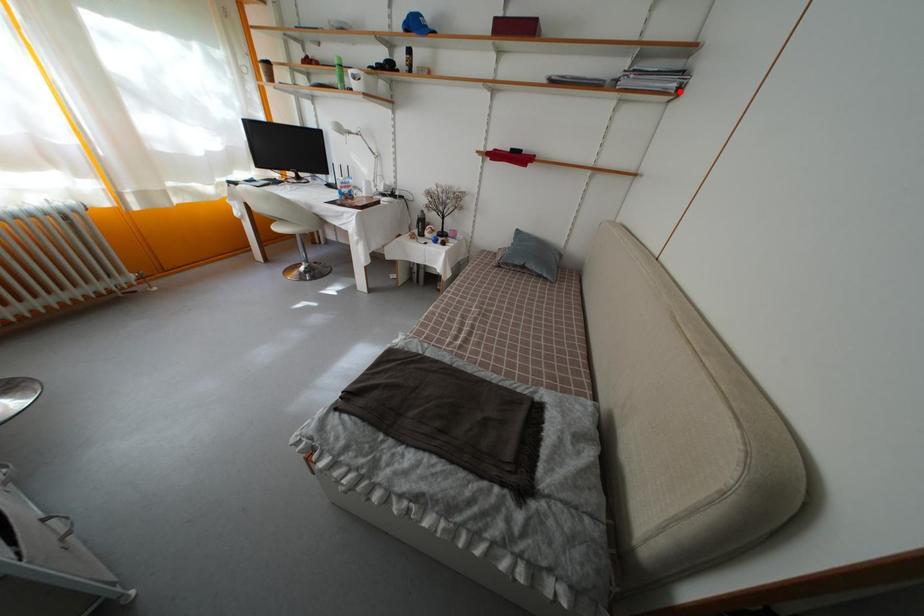
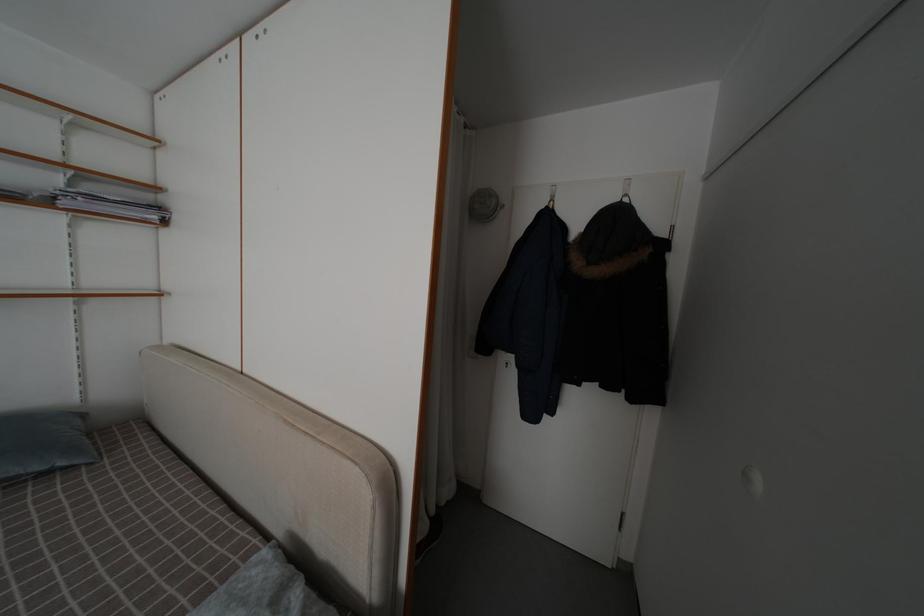
Question: I am providing you with two images of the same scene from different viewpoints. A red point is marked on the first image. Can you still see the location of the red point in image 2?

Choices:
 (A) Yes
 (B) No

Answer: (A)